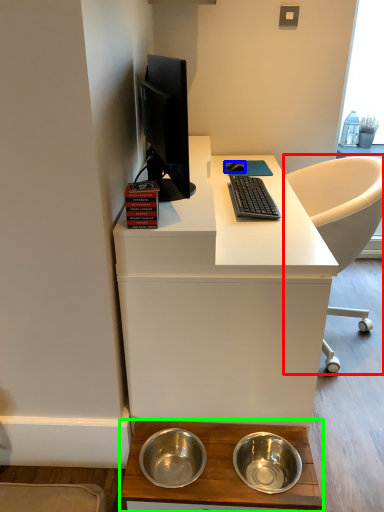
Question: Considering the real-world distances, which object is farthest from chair (highlighted by a red box)? mouse (highlighted by a blue box) or desk (highlighted by a green box)?

Choices:
 (A) mouse
 (B) desk

Answer: (B)